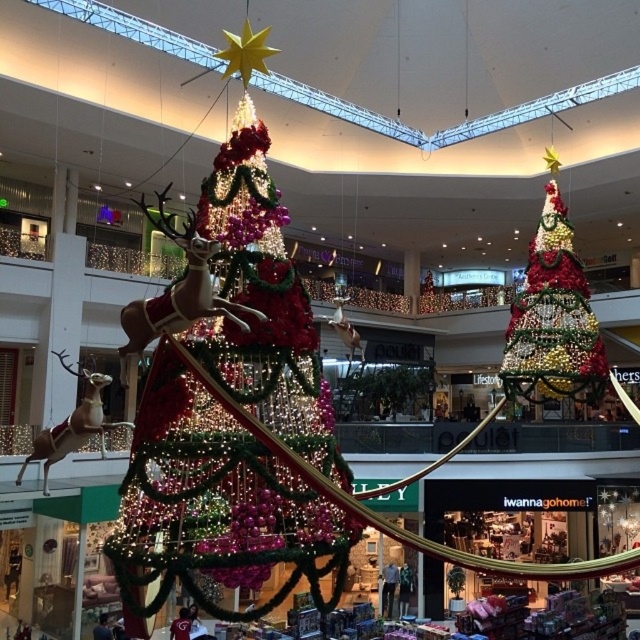
Question: Does iridescent glass christmas tree at center have a smaller size compared to shiny metallic christmas tree at upper right?

Choices:
 (A) yes
 (B) no

Answer: (A)

Question: Observing the image, what is the correct spatial positioning of iridescent glass christmas tree at center in reference to shiny metallic christmas tree at upper right?

Choices:
 (A) below
 (B) above

Answer: (A)

Question: Can you confirm if iridescent glass christmas tree at center is positioned to the right of shiny metallic christmas tree at upper right?

Choices:
 (A) no
 (B) yes

Answer: (A)